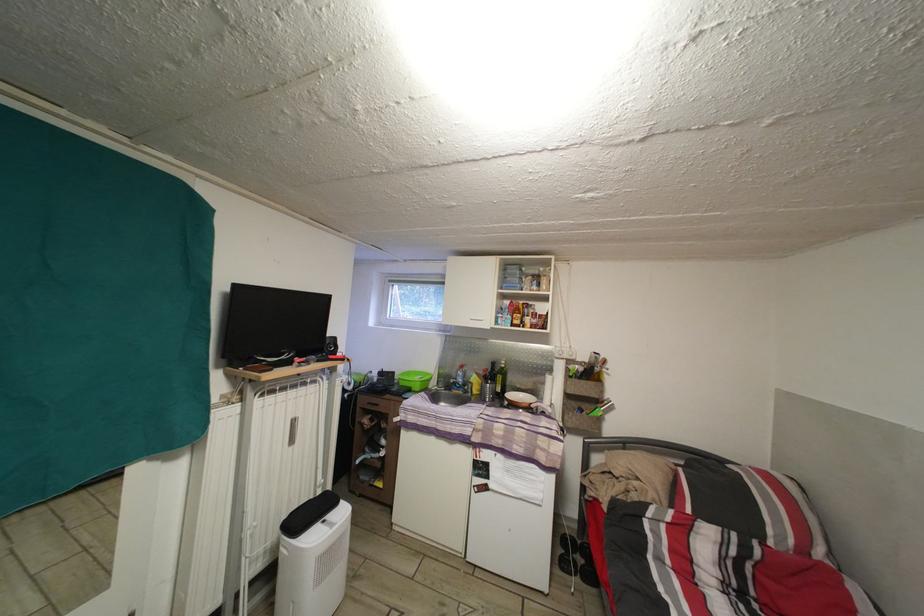
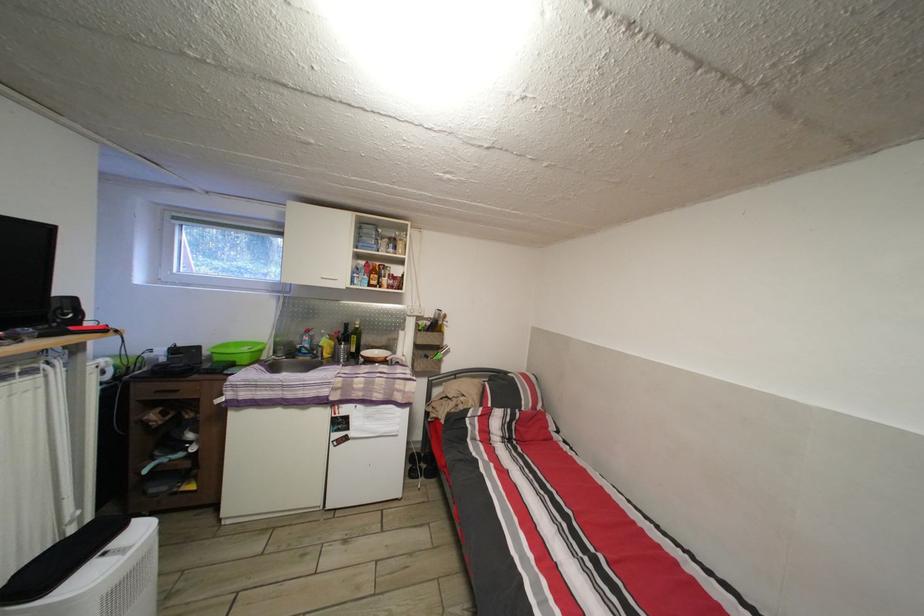
Find the pixel in the second image that matches (x=404, y=384) in the first image.

(213, 359)